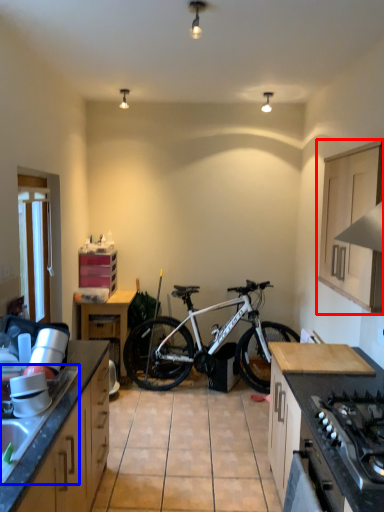
Question: Which of the following is the farthest to the observer, cabinetry (highlighted by a red box) or sink (highlighted by a blue box)?

Choices:
 (A) cabinetry
 (B) sink

Answer: (A)